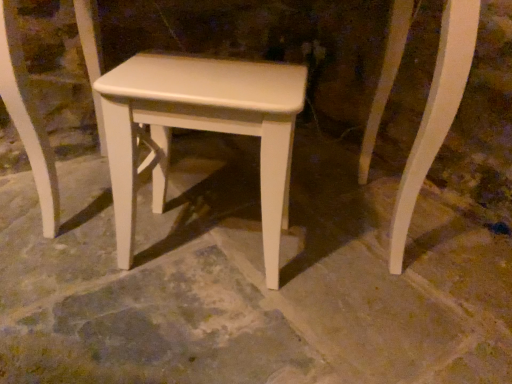
The image size is (512, 384). Identify the location of vacant space to the right of white matte stool at center. (337, 264).